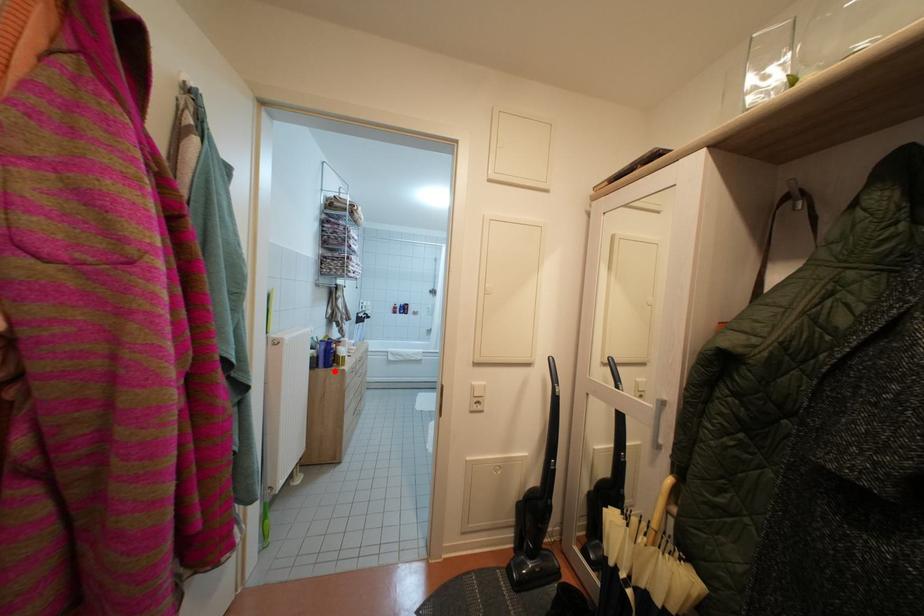
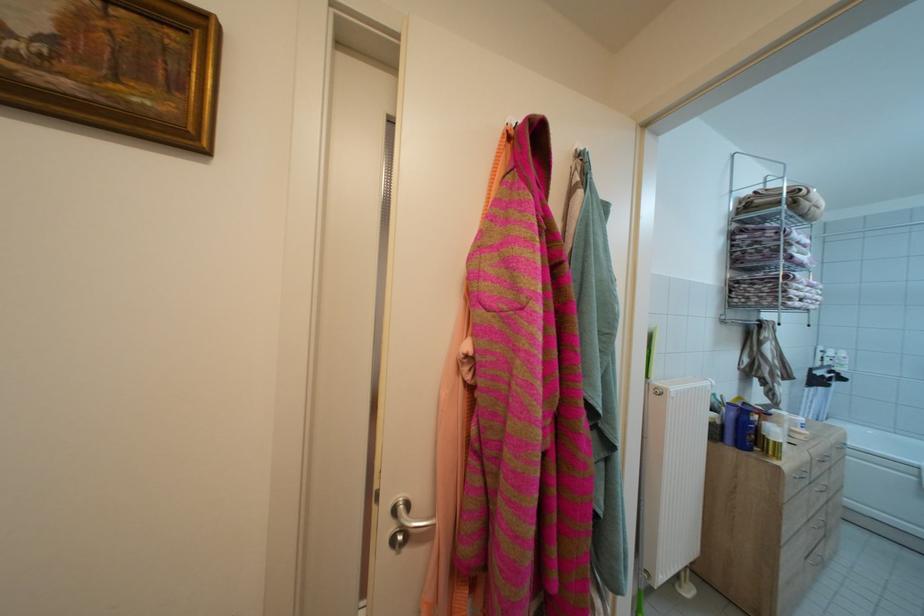
The point at the highlighted location is marked in the first image. Where is the corresponding point in the second image?

(748, 451)